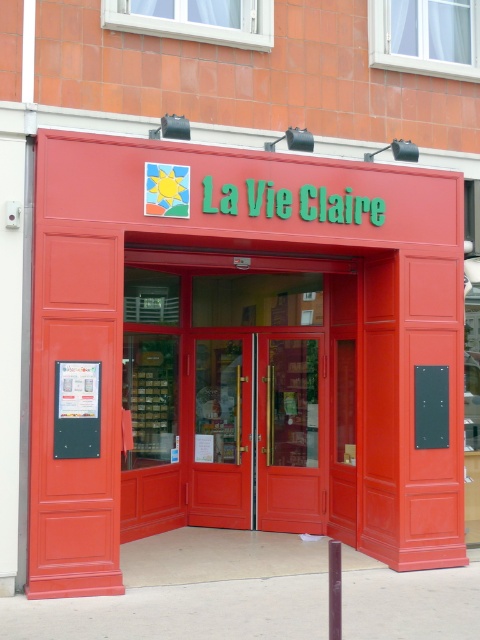
Can you confirm if smooth glossy door at center is thinner than metallic pole at center?

No.

Is smooth glossy door at center wider than metallic pole at center?

Correct, the width of smooth glossy door at center exceeds that of metallic pole at center.

Between point (215, 410) and point (336, 545), which one is positioned in front?

Point (336, 545) is more forward.

At what (x,y) coordinates should I click in order to perform the action: click on smooth glossy door at center. Please return your answer as a coordinate pair (x, y). Looking at the image, I should click on (240, 397).

In the scene shown: Is matte red doors at center smaller than matte red door at center?

Yes, matte red doors at center is smaller than matte red door at center.

Who is more distant from viewer, (59, 268) or (319, 472)?

The point (319, 472) is behind.

Image resolution: width=480 pixels, height=640 pixels. Find the location of `matte red doors at center`. matte red doors at center is located at coordinates (240, 353).

You are a GUI agent. You are given a task and a screenshot of the screen. Output one action in this format:
    pyautogui.click(x=<x>, y=<y>)
    Task: Click on the matte red doors at center
    
    Given the screenshot: What is the action you would take?
    pyautogui.click(x=240, y=353)

Who is more distant from viewer, (456, 404) or (333, 588)?

The point (456, 404) is behind.

Does matte red doors at center appear under metallic pole at center?

Actually, matte red doors at center is above metallic pole at center.

Where is `matte red doors at center`? The width and height of the screenshot is (480, 640). matte red doors at center is located at coordinates (240, 353).